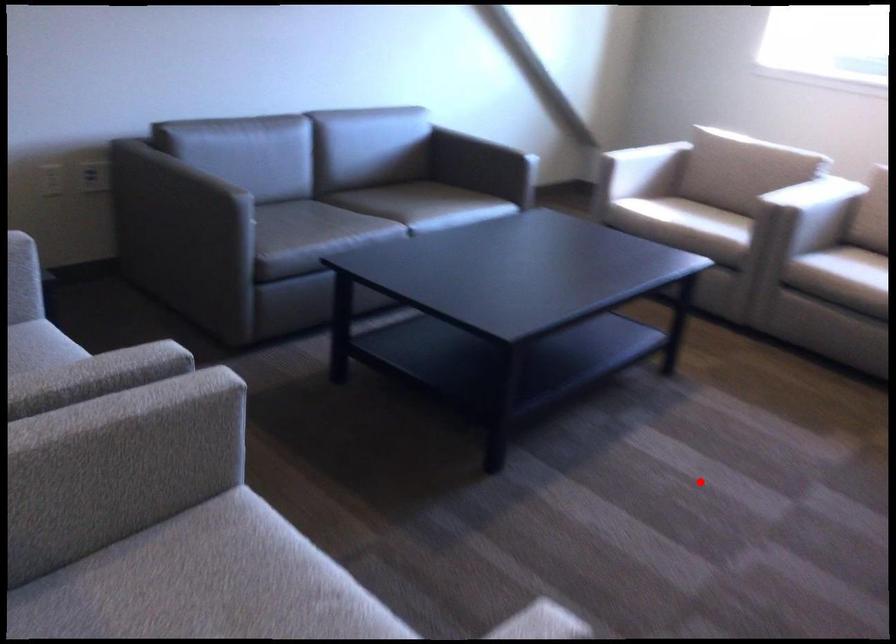
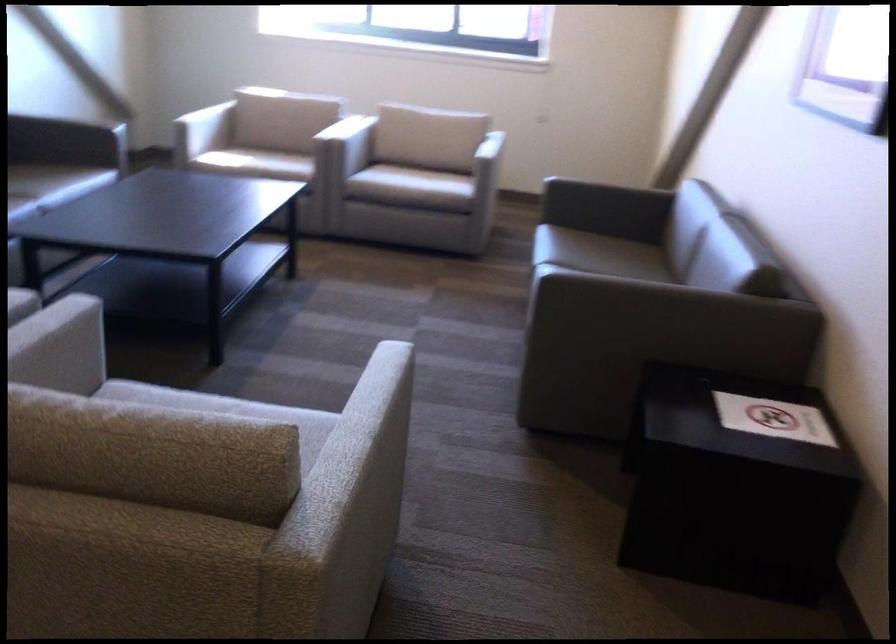
Where in the second image is the point corresponding to the highlighted location from the first image?

(352, 330)